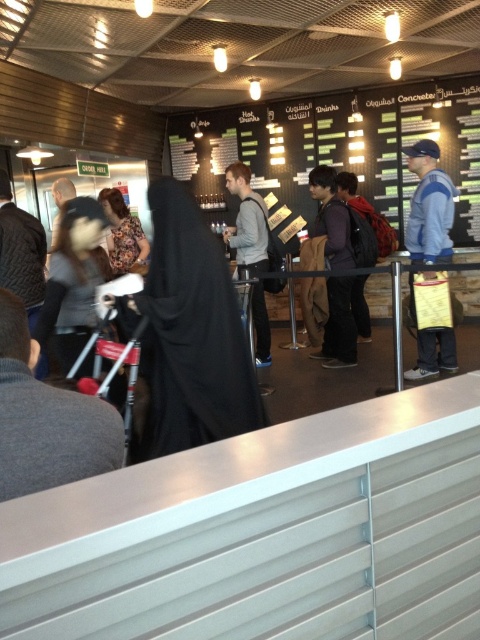
You are standing in line at the counter and want to know if you can reach the menu board behind the black matte abaya at center without moving closer. The menu board is 6 feet away from you. Can you see the menu board clearly?

The black matte abaya at center is 7.38 feet away from you, which is farther than the 6 feet distance to the menu board. Since the abaya is behind you, it won t block your view. You can see the menu board clearly.